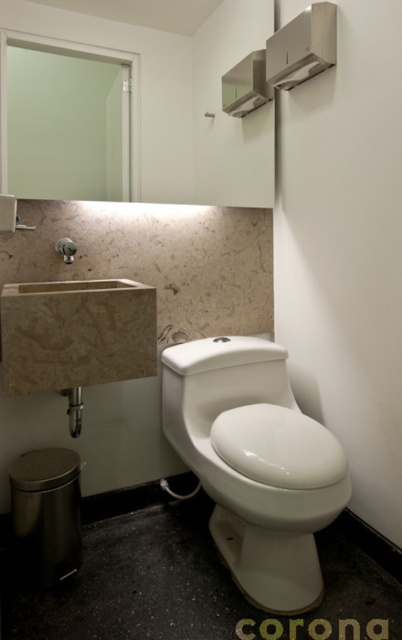
In the scene shown: You are a contractor installing a new light fixture between the green matte mirror at upper left and the brushed metal faucet at left. The light fixture requires a minimum of 18 inches of space to be safely installed. Based on the provided information, will there be enough space for the installation?

The green matte mirror at upper left is 16.08 inches away from the brushed metal faucet at left. Since the required space is 18 inches, there is insufficient space for the installation.

You are standing in the bathroom and want to reach the point at coordinates point (248, 29). If your arm can extend 5 feet, can you reach it without moving?

The point (248, 29) is 6.38 feet away from you, which is beyond the 5 feet reach of your arm. Therefore, you cannot reach it without moving.

You are standing in the bathroom and want to check your reflection in the green matte mirror at upper left. Where should you position yourself to see your reflection clearly?

To see your reflection clearly in the green matte mirror at upper left, you should position yourself directly in front of it, facing the mirror.